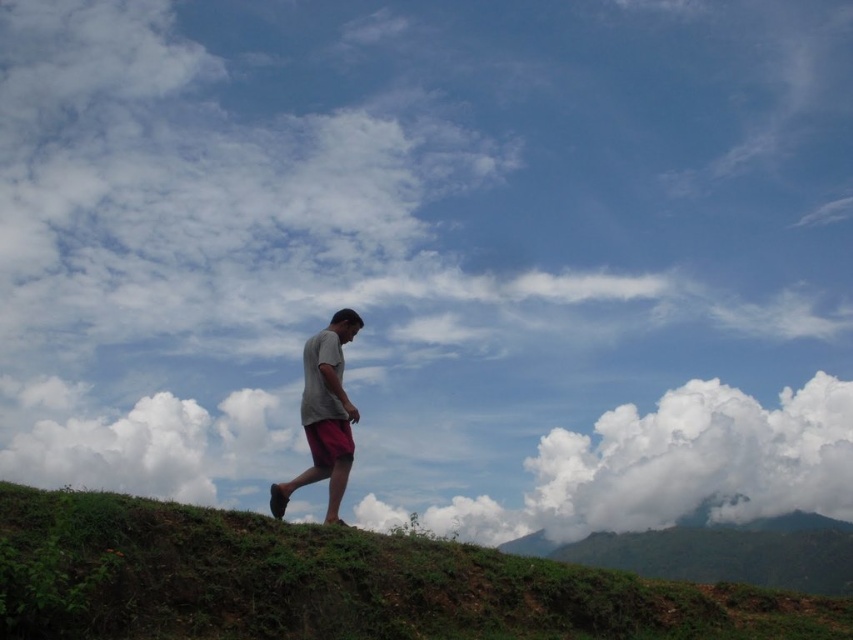
Can you confirm if gray matte shirt at center is positioned to the left of red cotton shorts at center?

Yes, gray matte shirt at center is to the left of red cotton shorts at center.

Between gray matte shirt at center and red cotton shorts at center, which one appears on the left side from the viewer's perspective?

gray matte shirt at center is more to the left.

The height and width of the screenshot is (640, 853). What do you see at coordinates (323, 416) in the screenshot? I see `gray matte shirt at center` at bounding box center [323, 416].

Find the location of `gray matte shirt at center`. gray matte shirt at center is located at coordinates (323, 416).

Is white fluffy cloud at right shorter than white fluffy cloud at upper left?

Yes.

Is white fluffy cloud at right further to camera compared to white fluffy cloud at upper left?

Yes, it is.

Identify the location of white fluffy cloud at right. The height and width of the screenshot is (640, 853). (677, 465).

Who is lower down, green leafy hillside at lower right or red cotton shorts at center?

green leafy hillside at lower right

Is green leafy hillside at lower right to the right of red cotton shorts at center from the viewer's perspective?

Yes, green leafy hillside at lower right is to the right of red cotton shorts at center.

The image size is (853, 640). Describe the element at coordinates (718, 550) in the screenshot. I see `green leafy hillside at lower right` at that location.

You are a GUI agent. You are given a task and a screenshot of the screen. Output one action in this format:
    pyautogui.click(x=<x>, y=<y>)
    Task: Click on the green leafy hillside at lower right
    Image resolution: width=853 pixels, height=640 pixels.
    Given the screenshot: What is the action you would take?
    pyautogui.click(x=718, y=550)